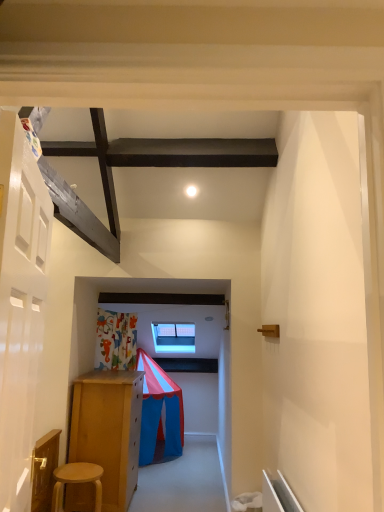
The width and height of the screenshot is (384, 512). Describe the element at coordinates (77, 481) in the screenshot. I see `light brown wooden stool at lower left` at that location.

You are a GUI agent. You are given a task and a screenshot of the screen. Output one action in this format:
    pyautogui.click(x=<x>, y=<y>)
    Task: Click on the white glossy light at upper center
    The height and width of the screenshot is (512, 384).
    Given the screenshot: What is the action you would take?
    pyautogui.click(x=191, y=191)

Is light brown wooden stool at lower left oriented towards white glossy light at upper center?

No, light brown wooden stool at lower left does not turn towards white glossy light at upper center.

Between light brown wooden stool at lower left and white glossy light at upper center, which one is positioned in front?

Positioned in front is light brown wooden stool at lower left.

Looking at the image, does light brown wooden stool at lower left seem bigger or smaller compared to white glossy light at upper center?

Considering their sizes, light brown wooden stool at lower left takes up more space than white glossy light at upper center.

From a real-world perspective, which object stands above the other?

white glossy light at upper center is physically above.

Is white glossy door at left wider or thinner than light brown wooden stool at lower left?

In the image, white glossy door at left appears to be more narrow than light brown wooden stool at lower left.

Which is nearer, (18, 177) or (69, 473)?

The point (18, 177) is more forward.

From a real-world perspective, which object stands above the other?

From a 3D spatial view, white glossy door at left is above.

Is white glossy door at left far away from light brown wooden stool at lower left?

Yes, white glossy door at left and light brown wooden stool at lower left are quite far apart.

In terms of height, does white glossy light at upper center look taller or shorter compared to white glossy door at left?

Considering their sizes, white glossy light at upper center has less height than white glossy door at left.

Based on the photo, is white glossy light at upper center facing towards white glossy door at left?

No, white glossy light at upper center is not oriented towards white glossy door at left.

Which point is more forward, [196,187] or [29,322]?

The point [29,322] is closer.

Which object is positioned more to the left, white glossy light at upper center or white glossy door at left?

Positioned to the left is white glossy door at left.

Is light brown wooden stool at lower left to the right of white glossy door at left from the viewer's perspective?

No, light brown wooden stool at lower left is not to the right of white glossy door at left.

Does light brown wooden stool at lower left contain white glossy door at left?

Actually, white glossy door at left is outside light brown wooden stool at lower left.

From a real-world perspective, is light brown wooden stool at lower left positioned under white glossy door at left based on gravity?

Yes.

At what (x,y) coordinates should I click in order to perform the action: click on stool below the white glossy light at upper center (from the image's perspective). Please return your answer as a coordinate pair (x, y). The width and height of the screenshot is (384, 512). Looking at the image, I should click on (77, 481).

What's the angular difference between white glossy light at upper center and light brown wooden stool at lower left's facing directions?

12 degrees.

Is white glossy light at upper center situated inside light brown wooden stool at lower left or outside?

The correct answer is: outside.

Is white glossy light at upper center in front of light brown wooden stool at lower left?

That is False.

Locate an element on the screen. The width and height of the screenshot is (384, 512). light on the right of the white glossy door at left is located at coordinates (191, 191).

From the image's perspective, relative to white glossy light at upper center, is white glossy door at left above or below?

white glossy door at left is below white glossy light at upper center.

Which of these two, white glossy door at left or white glossy light at upper center, is thinner?

white glossy door at left is thinner.

I want to click on stool in front of the white glossy light at upper center, so click(x=77, y=481).

This screenshot has height=512, width=384. I want to click on door on the right of light brown wooden stool at lower left, so click(20, 305).

From the image, which object appears to be nearer to light brown wooden stool at lower left, white glossy door at left or white glossy light at upper center?

Based on the image, white glossy door at left appears to be nearer to light brown wooden stool at lower left.

Looking at the image, which one is located closer to white glossy door at left, light brown wooden stool at lower left or white glossy light at upper center?

light brown wooden stool at lower left lies closer to white glossy door at left than the other object.

From the image, which object appears to be farther from light brown wooden stool at lower left, white glossy light at upper center or white glossy door at left?

white glossy light at upper center lies further to light brown wooden stool at lower left than the other object.

When comparing their distances from white glossy door at left, does white glossy light at upper center or light brown wooden stool at lower left seem closer?

Among the two, light brown wooden stool at lower left is located nearer to white glossy door at left.

Considering their positions, is white glossy door at left positioned further to white glossy light at upper center than light brown wooden stool at lower left?

light brown wooden stool at lower left lies further to white glossy light at upper center than the other object.

Which object lies nearer to the anchor point white glossy light at upper center, light brown wooden stool at lower left or white glossy door at left?

white glossy door at left.

Where is `stool between white glossy door at left and white glossy light at upper center in the front-back direction`? stool between white glossy door at left and white glossy light at upper center in the front-back direction is located at coordinates (77, 481).